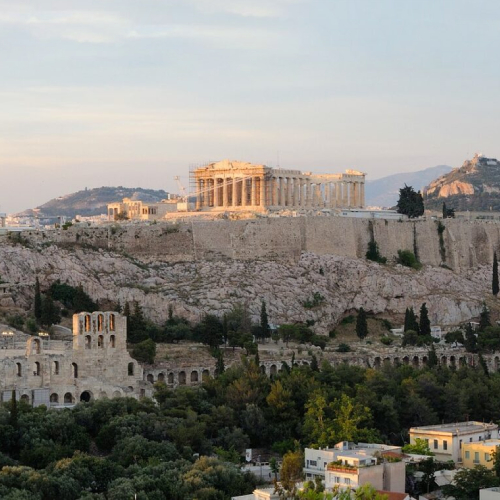
Where is `spoltlights`? The width and height of the screenshot is (500, 500). spoltlights is located at coordinates pos(7,333), pos(42,333).